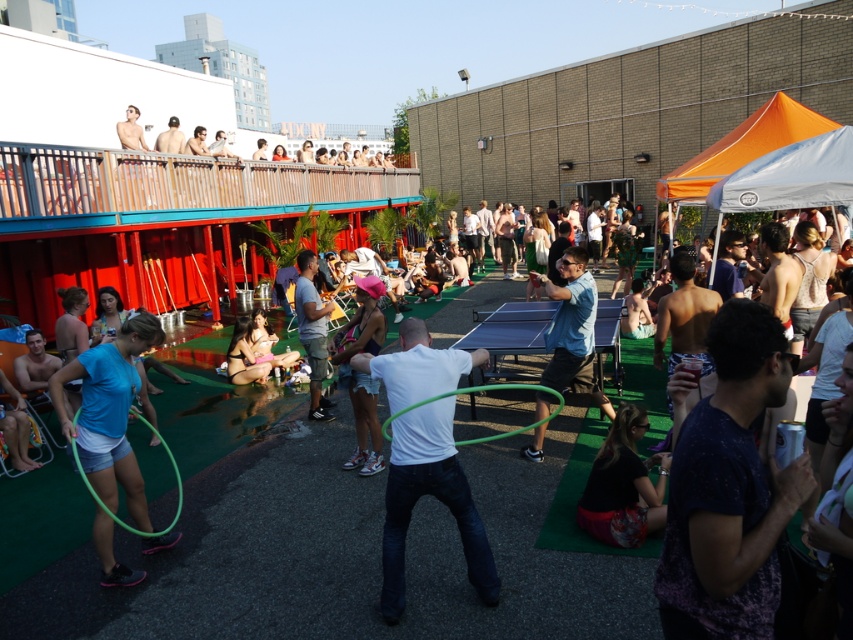
You are standing at the point labeled point (102, 403) and want to walk towards the point labeled point (450, 433). Which direction should you move to get closer to your destination?

You should move forward because point (450, 433) is closer to the camera than point (102, 403), meaning it is in front of your current position.

You are standing at the point labeled point (567, 259) and want to walk towards the point labeled point (299, 314). Given that you can only move in a straight line, will you be moving towards the background or towards the foreground of the image?

You will be moving towards the background of the image because point (567, 259) is closer to the viewer than point (299, 314), so moving from the closer point to the farther one takes you deeper into the scene.